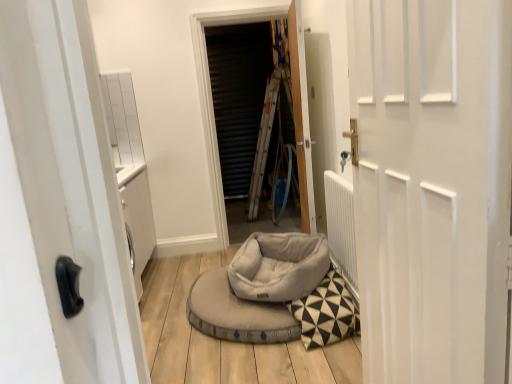
Locate an element on the screen. The image size is (512, 384). blank space situated above metallic silver screen at center (from a real-world perspective) is located at coordinates (245, 4).